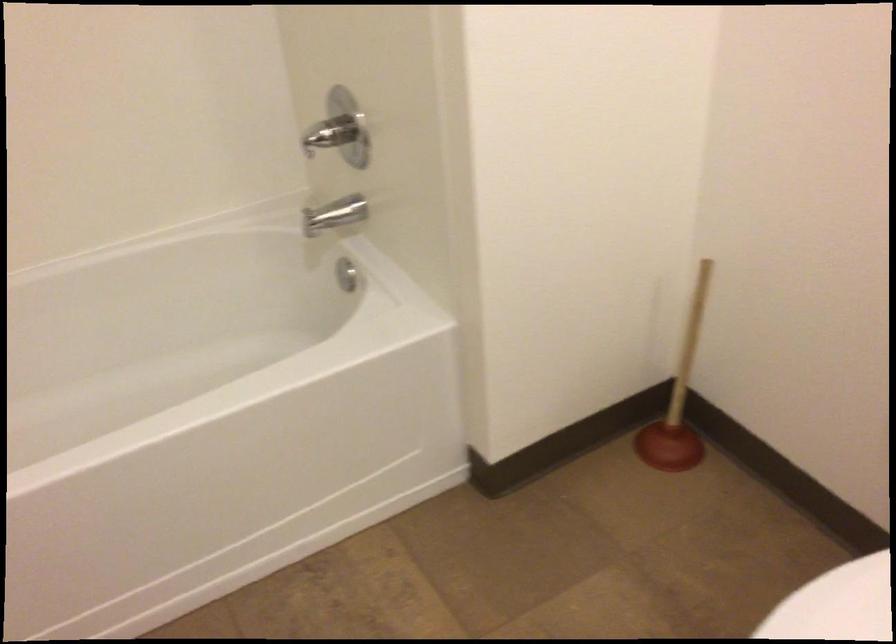
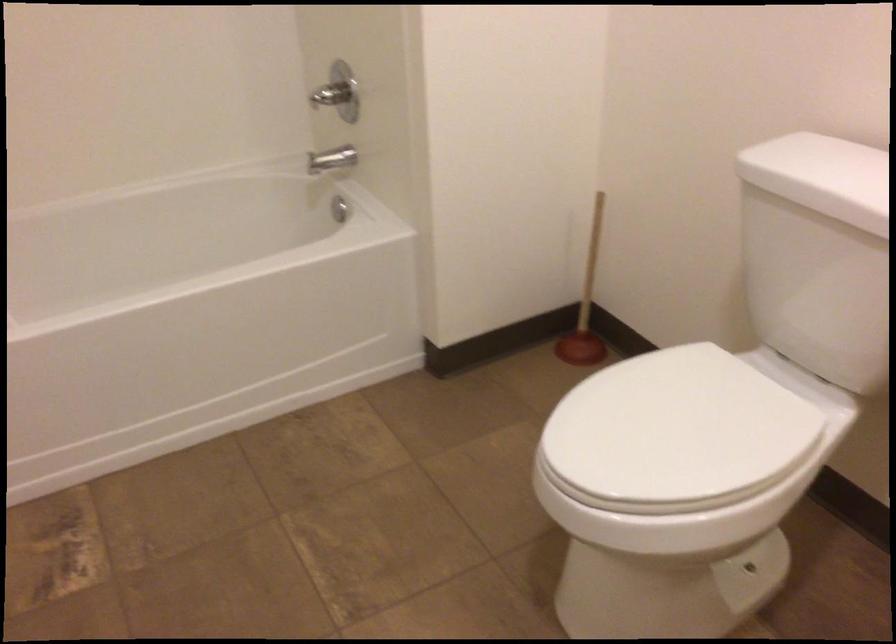
Find the pixel in the second image that matches the point at 682,395 in the first image.

(586, 305)